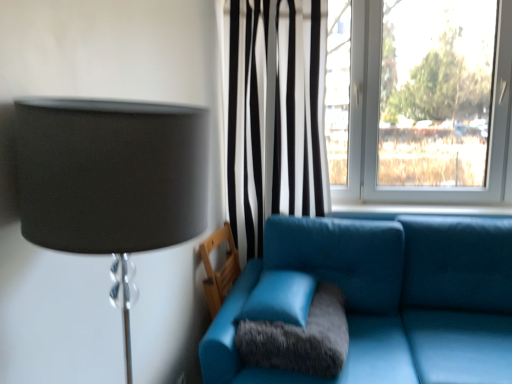
The width and height of the screenshot is (512, 384). What are the coordinates of `blue fabric window sill at center` in the screenshot? It's located at (416, 210).

In order to face blue fabric window sill at center, should I rotate leftwards or rightwards?

You should rotate right by 17.937 degrees.

Locate an element on the screen. Image resolution: width=512 pixels, height=384 pixels. teal leather couch at center is located at coordinates pyautogui.click(x=390, y=298).

This screenshot has height=384, width=512. Describe the element at coordinates (275, 115) in the screenshot. I see `black striped curtain at center` at that location.

Locate an element on the screen. The width and height of the screenshot is (512, 384). matte black lampshade at left is located at coordinates (111, 180).

Find the location of a particular element. Image resolution: width=512 pixels, height=384 pixels. blue fabric window sill at center is located at coordinates (416, 210).

Which of these two, black striped curtain at center or matte leather pillow at center, stands taller?

black striped curtain at center.

From the picture: Is black striped curtain at center facing away from matte leather pillow at center?

No, black striped curtain at center is not facing away from matte leather pillow at center.

Based on the photo, how many degrees apart are the facing directions of black striped curtain at center and matte leather pillow at center?

black striped curtain at center and matte leather pillow at center are facing 2.58 degrees away from each other.

From a real-world perspective, which is physically above, black striped curtain at center or matte leather pillow at center?

black striped curtain at center is physically above.

Considering the sizes of matte black lampshade at left and fuzzy gray pillow at center in the image, is matte black lampshade at left wider or thinner than fuzzy gray pillow at center?

Clearly, matte black lampshade at left has less width compared to fuzzy gray pillow at center.

Can you confirm if matte black lampshade at left is bigger than fuzzy gray pillow at center?

Yes, matte black lampshade at left is bigger than fuzzy gray pillow at center.

Is matte black lampshade at left at the left side of fuzzy gray pillow at center?

Indeed, matte black lampshade at left is positioned on the left side of fuzzy gray pillow at center.

Is matte leather pillow at center in front of or behind matte black lampshade at left in the image?

matte leather pillow at center is behind matte black lampshade at left.

Is matte leather pillow at center far from matte black lampshade at left?

Yes, matte leather pillow at center is far from matte black lampshade at left.

Is matte leather pillow at center smaller than matte black lampshade at left?

Yes, matte leather pillow at center is smaller than matte black lampshade at left.

In order to click on lamp in front of the matte leather pillow at center in this screenshot , I will do `click(111, 180)`.

Does teal leather couch at center have a smaller size compared to matte leather pillow at center?

No.

Considering the positions of objects teal leather couch at center and matte leather pillow at center in the image provided, who is in front, teal leather couch at center or matte leather pillow at center?

Positioned in front is teal leather couch at center.

Considering the positions of points (449, 341) and (295, 312), is point (449, 341) farther from camera compared to point (295, 312)?

Yes, point (449, 341) is farther from viewer.

Does teal leather couch at center have a lesser height compared to matte leather pillow at center?

No.

From the image's perspective, relative to teal leather armchair at lower center, is matte leather pillow at center above or below?

From the image's perspective, matte leather pillow at center appears above teal leather armchair at lower center.

Which object is positioned more to the right, matte leather pillow at center or teal leather armchair at lower center?

From the viewer's perspective, matte leather pillow at center appears more on the right side.

Considering the sizes of matte leather pillow at center and teal leather armchair at lower center in the image, is matte leather pillow at center bigger or smaller than teal leather armchair at lower center?

In the image, matte leather pillow at center appears to be smaller than teal leather armchair at lower center.

Between point (261, 318) and point (208, 250), which one is positioned in front?

Point (261, 318)

In the image, is matte leather pillow at center positioned in front of or behind fuzzy gray pillow at center?

In the image, matte leather pillow at center appears behind fuzzy gray pillow at center.

Is matte leather pillow at center oriented away from fuzzy gray pillow at center?

No, matte leather pillow at center's orientation is not away from fuzzy gray pillow at center.

Considering the relative positions of matte leather pillow at center and fuzzy gray pillow at center in the image provided, is matte leather pillow at center to the right of fuzzy gray pillow at center from the viewer's perspective?

Incorrect, matte leather pillow at center is not on the right side of fuzzy gray pillow at center.

Does matte leather pillow at center have a greater height compared to fuzzy gray pillow at center?

No.

From a real-world perspective, is black striped curtain at center located beneath fuzzy gray pillow at center?

No, from a real-world perspective, black striped curtain at center is not under fuzzy gray pillow at center.

Is point (240, 111) positioned in front of point (326, 303)?

No, (240, 111) is behind (326, 303).

Could you tell me if black striped curtain at center is facing fuzzy gray pillow at center?

Yes, black striped curtain at center is facing fuzzy gray pillow at center.

The width and height of the screenshot is (512, 384). In order to click on curtain on the left of fuzzy gray pillow at center in this screenshot , I will do `click(275, 115)`.

You are a GUI agent. You are given a task and a screenshot of the screen. Output one action in this format:
    pyautogui.click(x=<x>, y=<y>)
    Task: Click on the turquoise in front of the black striped curtain at center
    This screenshot has height=384, width=512.
    Given the screenshot: What is the action you would take?
    (x=280, y=298)

This screenshot has height=384, width=512. I want to click on pillow that is under the matte black lampshade at left (from a real-world perspective), so click(300, 338).

Estimate the real-world distances between objects in this image. Which object is further from blue fabric window sill at center, teal leather couch at center or black striped curtain at center?

black striped curtain at center.

Considering their positions, is teal leather armchair at lower center positioned closer to matte leather pillow at center than matte black lampshade at left?

teal leather armchair at lower center lies closer to matte leather pillow at center than the other object.

From the image, which object appears to be farther from matte leather pillow at center, teal leather couch at center or matte black lampshade at left?

Based on the image, matte black lampshade at left appears to be further to matte leather pillow at center.

From the image, which object appears to be farther from teal leather couch at center, teal leather armchair at lower center or blue fabric window sill at center?

Based on the image, teal leather armchair at lower center appears to be further to teal leather couch at center.

Considering their positions, is fuzzy gray pillow at center positioned closer to blue fabric window sill at center than matte black lampshade at left?

The object closer to blue fabric window sill at center is fuzzy gray pillow at center.

Looking at this image, based on their spatial positions, is black striped curtain at center or teal leather couch at center closer to teal leather armchair at lower center?

black striped curtain at center lies closer to teal leather armchair at lower center than the other object.

Based on their spatial positions, is teal leather armchair at lower center or blue fabric window sill at center closer to matte leather pillow at center?

Based on the image, teal leather armchair at lower center appears to be nearer to matte leather pillow at center.

Based on their spatial positions, is teal leather couch at center or blue fabric window sill at center closer to black striped curtain at center?

blue fabric window sill at center lies closer to black striped curtain at center than the other object.

The image size is (512, 384). I want to click on window sill between black striped curtain at center and fuzzy gray pillow at center in the up-down direction, so click(x=416, y=210).

At what (x,y) coordinates should I click in order to perform the action: click on turquoise between teal leather couch at center and teal leather armchair at lower center from front to back. Please return your answer as a coordinate pair (x, y). Looking at the image, I should click on (280, 298).

Where is `turquoise between teal leather armchair at lower center and blue fabric window sill at center in the horizontal direction`? turquoise between teal leather armchair at lower center and blue fabric window sill at center in the horizontal direction is located at coordinates (280, 298).

Locate an element on the screen. This screenshot has height=384, width=512. turquoise between matte black lampshade at left and blue fabric window sill at center in the front-back direction is located at coordinates (280, 298).